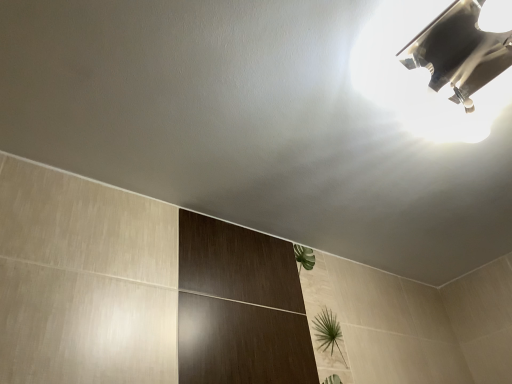
Identify the location of metallic silver droplight at upper right. This screenshot has width=512, height=384. (438, 64).

This screenshot has width=512, height=384. Describe the element at coordinates (438, 64) in the screenshot. I see `metallic silver droplight at upper right` at that location.

Where is `metallic silver droplight at upper right`? This screenshot has width=512, height=384. metallic silver droplight at upper right is located at coordinates (438, 64).